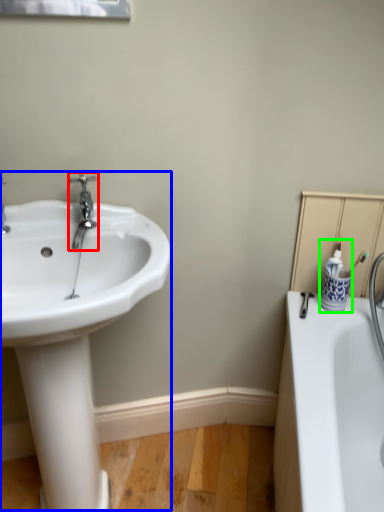
Question: Based on their relative distances, which object is nearer to tap (highlighted by a red box)? Choose from sink (highlighted by a blue box) and toiletry (highlighted by a green box).

Choices:
 (A) sink
 (B) toiletry

Answer: (A)